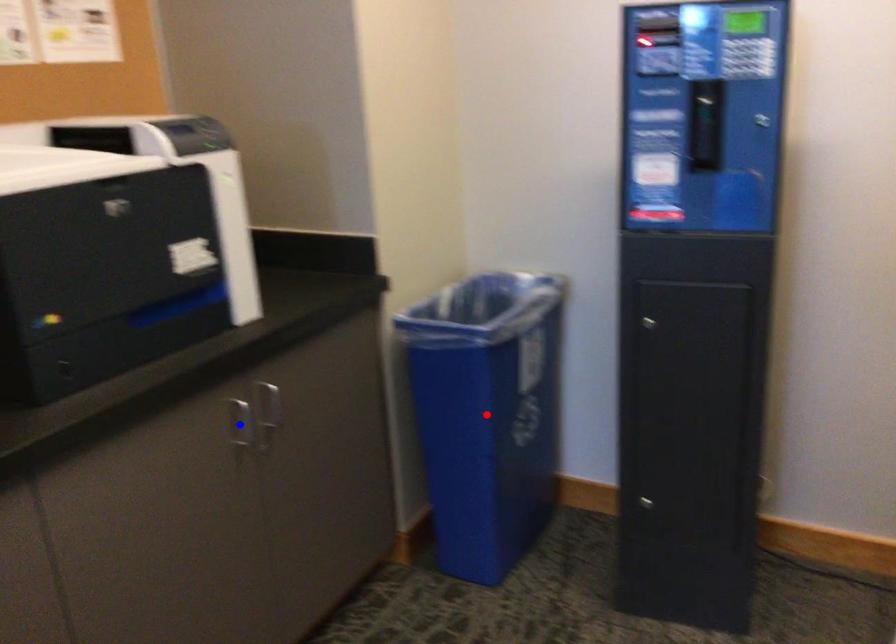
Question: Two points are marked on the image. Which point is closer to the camera?

Choices:
 (A) Blue point is closer.
 (B) Red point is closer.

Answer: (A)